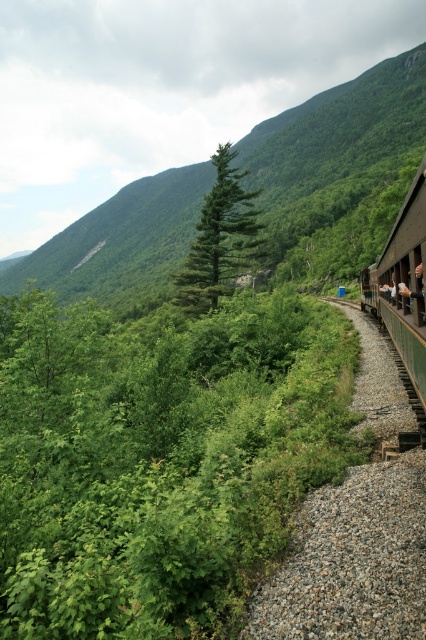
Can you confirm if green leafy hillside at upper left is positioned to the left of green wooden train at right?

Indeed, green leafy hillside at upper left is positioned on the left side of green wooden train at right.

Is the position of green leafy hillside at upper left less distant than that of green wooden train at right?

No, green leafy hillside at upper left is behind green wooden train at right.

Who is more forward, (201, 168) or (362, 292)?

Point (362, 292)

Identify the location of green leafy hillside at upper left. Image resolution: width=426 pixels, height=640 pixels. (337, 131).

Who is positioned more to the right, green leafy shrubs at center or green matte tree at center?

Positioned to the right is green leafy shrubs at center.

Between green leafy shrubs at center and green matte tree at center, which one appears on the left side from the viewer's perspective?

green matte tree at center is more to the left.

Identify the location of green leafy shrubs at center. Image resolution: width=426 pixels, height=640 pixels. (160, 460).

Can you confirm if green leafy hillside at upper left is taller than green matte tree at center?

Correct, green leafy hillside at upper left is much taller as green matte tree at center.

Between green leafy hillside at upper left and green matte tree at center, which one has less height?

With less height is green matte tree at center.

I want to click on green leafy hillside at upper left, so click(x=337, y=131).

You are a GUI agent. You are given a task and a screenshot of the screen. Output one action in this format:
    pyautogui.click(x=<x>, y=<y>)
    Task: Click on the green leafy hillside at upper left
    The height and width of the screenshot is (640, 426).
    Given the screenshot: What is the action you would take?
    pyautogui.click(x=337, y=131)